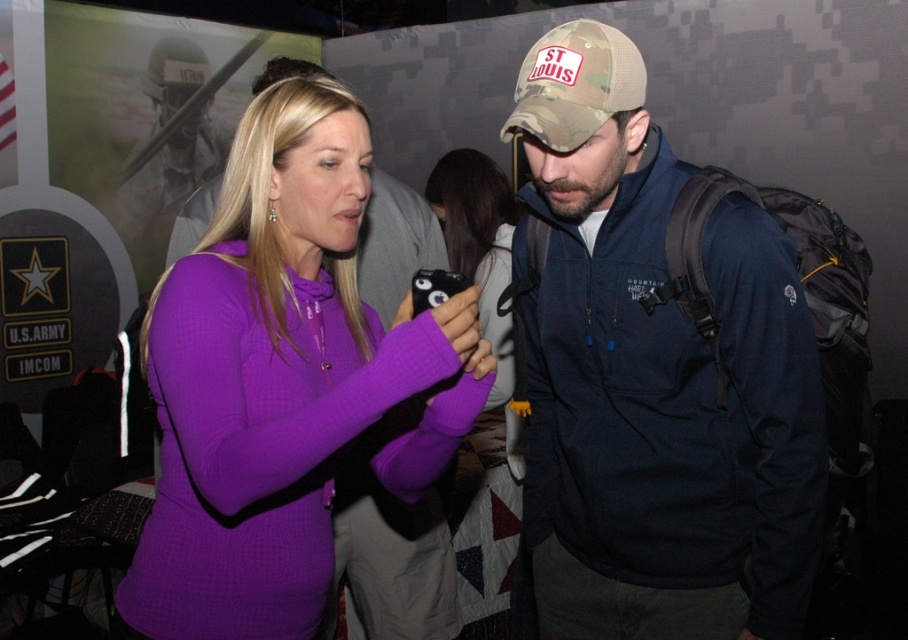
Which is more to the left, camo fabric hat at center or purple fleece sweater at center?

purple fleece sweater at center

Who is more forward, [646,627] or [301,208]?

Positioned in front is point [301,208].

Locate an element on the screen. The width and height of the screenshot is (908, 640). camo fabric hat at center is located at coordinates (654, 376).

Is camo fabric hat at center to the left of camouflage fabric helmet at upper left from the viewer's perspective?

In fact, camo fabric hat at center is to the right of camouflage fabric helmet at upper left.

Locate an element on the screen. This screenshot has height=640, width=908. camo fabric hat at center is located at coordinates pos(654,376).

Locate an element on the screen. camo fabric hat at center is located at coordinates (654, 376).

Is point (131, 195) closer to camera compared to point (601, 26)?

No.

Between camouflage fabric helmet at upper left and camo fabric baseball cap at center, which one appears on the left side from the viewer's perspective?

From the viewer's perspective, camouflage fabric helmet at upper left appears more on the left side.

Find the location of a particular element. The height and width of the screenshot is (640, 908). camouflage fabric helmet at upper left is located at coordinates [169, 150].